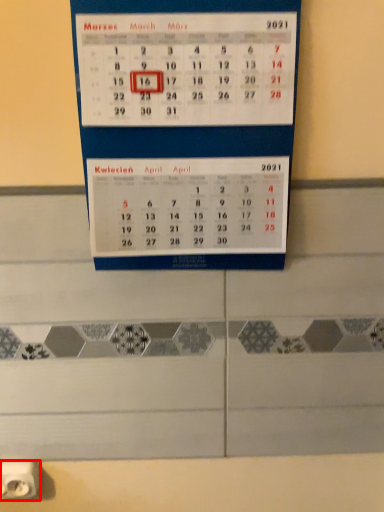
Question: Considering the relative positions of power plugs and sockets (annotated by the red box) and bulletin board in the image provided, where is power plugs and sockets (annotated by the red box) located with respect to the staircase?

Choices:
 (A) left
 (B) right

Answer: (A)